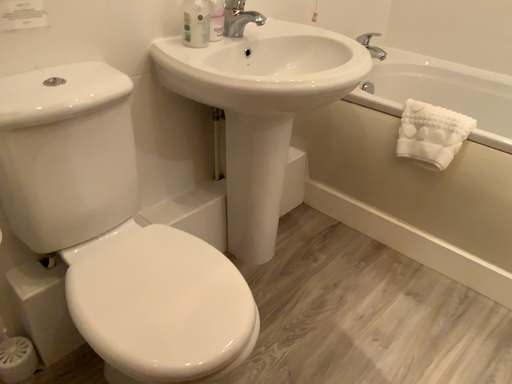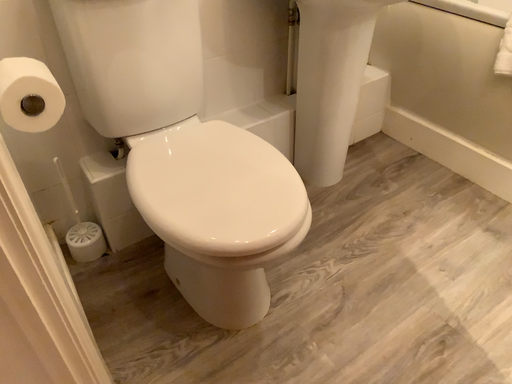
Question: How did the camera likely rotate when shooting the video?

Choices:
 (A) rotated left
 (B) rotated right

Answer: (A)